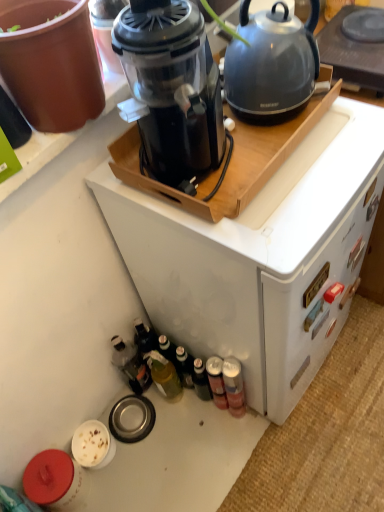
Locate an element on the screen. This screenshot has height=512, width=384. free space that is to the left of metallic silver can at lower right, which is the third bottle from left to right is located at coordinates (183, 428).